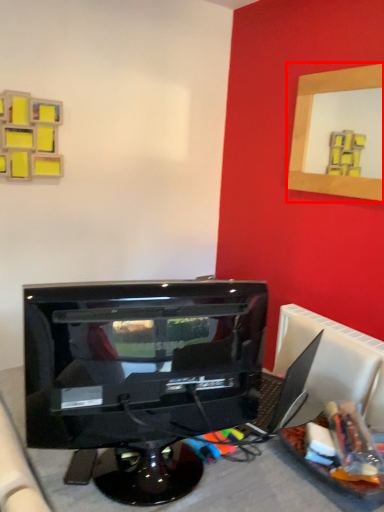
Question: From the image's perspective, what is the correct spatial positioning of picture frame (annotated by the red box) in reference to computer monitor?

Choices:
 (A) above
 (B) below

Answer: (A)